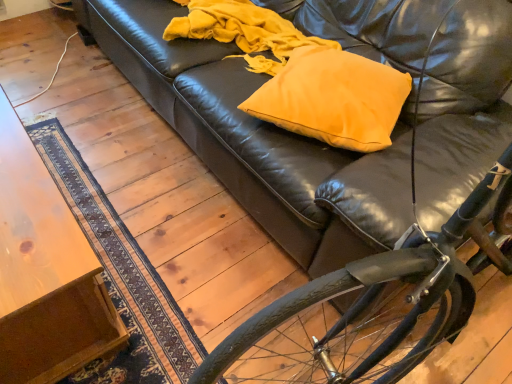
Describe the element at coordinates (333, 98) in the screenshot. I see `matte yellow pillow at center` at that location.

Locate an element on the screen. matte yellow pillow at center is located at coordinates click(333, 98).

Where is `wooden table at lower left`? wooden table at lower left is located at coordinates (45, 272).

Locate an element on the screen. matte yellow pillow at center is located at coordinates (333, 98).

Which object is positioned more to the right, matte yellow pillow at center or wooden table at lower left?

matte yellow pillow at center is more to the right.

Considering the sizes of objects matte yellow pillow at center and wooden table at lower left in the image provided, who is smaller, matte yellow pillow at center or wooden table at lower left?

Smaller between the two is matte yellow pillow at center.

Is wooden table at lower left inside matte yellow pillow at center?

No, wooden table at lower left is located outside of matte yellow pillow at center.

Is shiny black bicycle at lower right shorter than wooden table at lower left?

No, shiny black bicycle at lower right is not shorter than wooden table at lower left.

Is shiny black bicycle at lower right beside wooden table at lower left?

shiny black bicycle at lower right and wooden table at lower left are clearly separated.

Considering the positions of points (369, 360) and (62, 347), is point (369, 360) closer to camera compared to point (62, 347)?

Yes.

In terms of size, does matte yellow pillow at center appear bigger or smaller than shiny black bicycle at lower right?

Clearly, matte yellow pillow at center is smaller in size than shiny black bicycle at lower right.

Could you tell me if matte yellow pillow at center is facing shiny black bicycle at lower right?

Yes, matte yellow pillow at center faces towards shiny black bicycle at lower right.

Choose the correct answer: Is matte yellow pillow at center inside shiny black bicycle at lower right or outside it?

matte yellow pillow at center lies outside shiny black bicycle at lower right.

Locate an element on the screen. throw pillow behind the shiny black bicycle at lower right is located at coordinates (333, 98).

Visually, is wooden table at lower left positioned to the left or to the right of shiny black bicycle at lower right?

From the image, it's evident that wooden table at lower left is to the left of shiny black bicycle at lower right.

How many degrees apart are the facing directions of wooden table at lower left and shiny black bicycle at lower right?

The angle between the facing direction of wooden table at lower left and the facing direction of shiny black bicycle at lower right is 85.3 degrees.

From a real-world perspective, is wooden table at lower left below shiny black bicycle at lower right?

Yes, from a real-world perspective, wooden table at lower left is under shiny black bicycle at lower right.

Looking at this image, from the image's perspective, between wooden table at lower left and shiny black bicycle at lower right, who is located below?

From the image's view, wooden table at lower left is below.

In the image, is shiny black bicycle at lower right positioned in front of or behind matte yellow pillow at center?

shiny black bicycle at lower right is positioned closer to the viewer than matte yellow pillow at center.

Would you say shiny black bicycle at lower right contains matte yellow pillow at center?

No, shiny black bicycle at lower right does not contain matte yellow pillow at center.

Considering the positions of points (262, 331) and (336, 51), is point (262, 331) farther from camera compared to point (336, 51)?

No, it is in front of (336, 51).

The width and height of the screenshot is (512, 384). In order to click on bicycle above the matte yellow pillow at center (from a real-world perspective) in this screenshot , I will do coord(372,306).

Identify the location of throw pillow that is on the right side of wooden table at lower left. The width and height of the screenshot is (512, 384). (333, 98).

Looking at this image, from the image's perspective, is wooden table at lower left on matte yellow pillow at center?

Incorrect, from the image's perspective, wooden table at lower left is lower than matte yellow pillow at center.

Is matte yellow pillow at center a part of wooden table at lower left?

No, matte yellow pillow at center is not a part of wooden table at lower left.

At what (x,y) coordinates should I click in order to perform the action: click on table located underneath the matte yellow pillow at center (from a real-world perspective). Please return your answer as a coordinate pair (x, y). Looking at the image, I should click on pyautogui.click(x=45, y=272).

Find the location of a particular element. The height and width of the screenshot is (384, 512). bicycle that appears in front of the wooden table at lower left is located at coordinates (372, 306).

Based on their spatial positions, is shiny black bicycle at lower right or matte yellow pillow at center further from wooden table at lower left?

Among the two, matte yellow pillow at center is located further to wooden table at lower left.

When comparing their distances from shiny black bicycle at lower right, does wooden table at lower left or matte yellow pillow at center seem further?

wooden table at lower left is positioned further to the anchor shiny black bicycle at lower right.

Looking at the image, which one is located closer to shiny black bicycle at lower right, matte yellow pillow at center or wooden table at lower left?

matte yellow pillow at center.

Considering their positions, is matte yellow pillow at center positioned further to wooden table at lower left than shiny black bicycle at lower right?

matte yellow pillow at center is positioned further to the anchor wooden table at lower left.

Which object lies further to the anchor point matte yellow pillow at center, shiny black bicycle at lower right or wooden table at lower left?

Based on the image, wooden table at lower left appears to be further to matte yellow pillow at center.

Based on their spatial positions, is wooden table at lower left or shiny black bicycle at lower right closer to matte yellow pillow at center?

The object closer to matte yellow pillow at center is shiny black bicycle at lower right.

In order to click on throw pillow between wooden table at lower left and shiny black bicycle at lower right from left to right in this screenshot , I will do `click(333, 98)`.